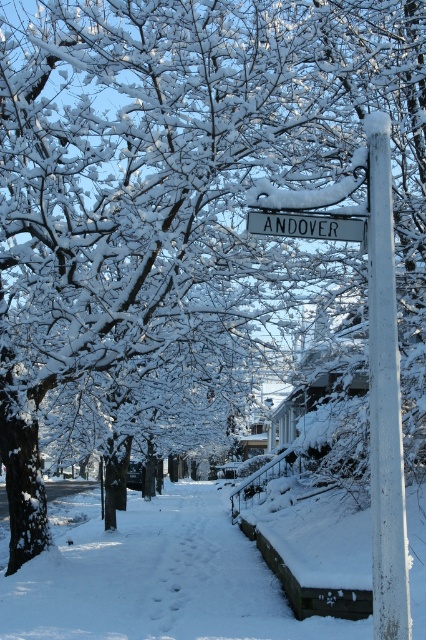
Measure the distance from white painted wood post at center right to white plastic sign at center.

white painted wood post at center right is 24.52 inches from white plastic sign at center.

Can you confirm if white painted wood post at center right is positioned to the right of white plastic sign at center?

Indeed, white painted wood post at center right is positioned on the right side of white plastic sign at center.

Identify the location of white painted wood post at center right. (385, 400).

At what (x,y) coordinates should I click in order to perform the action: click on white painted wood post at center right. Please return your answer as a coordinate pair (x, y). This screenshot has width=426, height=640. Looking at the image, I should click on (385, 400).

Between white powdery snow at center and white plastic sign at center, which one has less height?

With less height is white plastic sign at center.

Does white powdery snow at center have a greater width compared to white plastic sign at center?

Yes.

The width and height of the screenshot is (426, 640). In order to click on white powdery snow at center in this screenshot , I will do `click(155, 577)`.

This screenshot has width=426, height=640. In order to click on white powdery snow at center in this screenshot , I will do `click(155, 577)`.

Measure the distance from white powdery snow at center to white painted wood post at center right.

The distance of white powdery snow at center from white painted wood post at center right is 8.80 meters.

Is white powdery snow at center to the right of white painted wood post at center right from the viewer's perspective?

In fact, white powdery snow at center is to the left of white painted wood post at center right.

Who is more distant from viewer, (106, 593) or (382, 492)?

Positioned behind is point (106, 593).

Where is `white powdery snow at center`? Image resolution: width=426 pixels, height=640 pixels. white powdery snow at center is located at coordinates pos(155,577).